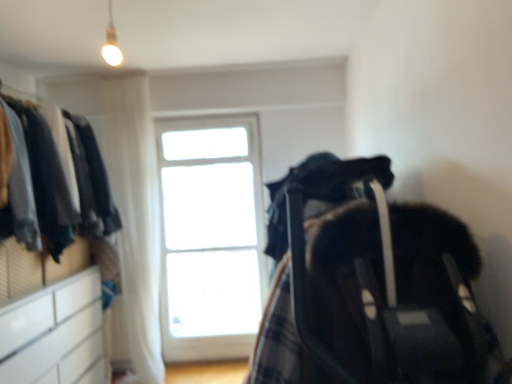
Identify the location of free space above white sheer curtain at upper left (from a real-world perspective). (116, 67).